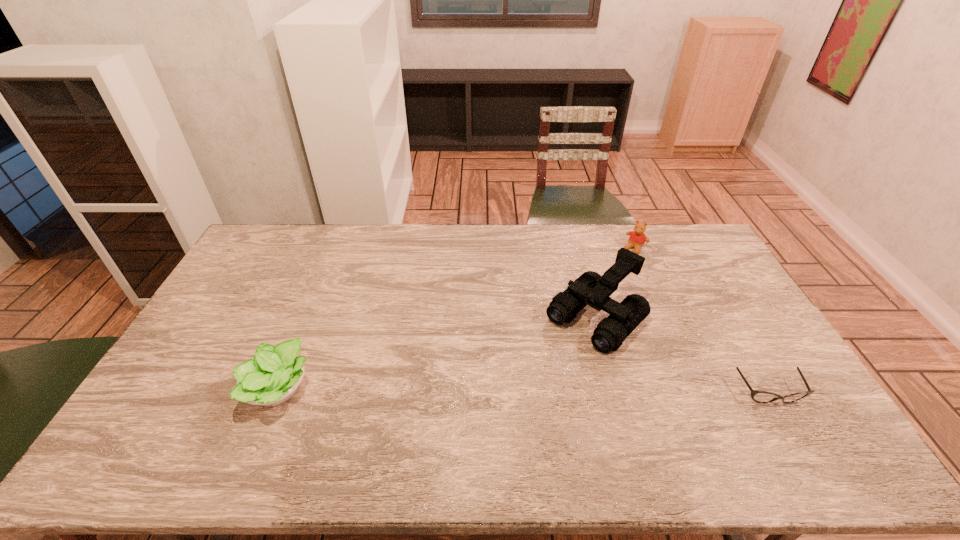
Where is `vacant space in between the tallest object and the lettuce`? The width and height of the screenshot is (960, 540). vacant space in between the tallest object and the lettuce is located at coordinates (438, 354).

Find the location of a particular element. vacant region between the lettuce and the binoculars is located at coordinates (438, 354).

The width and height of the screenshot is (960, 540). Identify the location of vacant space that is in between the lettuce and the binoculars. pyautogui.click(x=438, y=354).

Where is `free space between the leftmost object and the third object from right to left`? This screenshot has height=540, width=960. free space between the leftmost object and the third object from right to left is located at coordinates 438,354.

Locate an element on the screen. vacant space in between the third object from left to right and the lettuce is located at coordinates (457, 319).

Identify which object is located as the nearest to the leftmost object. Please provide its 2D coordinates. Your answer should be formatted as a tuple, i.e. [(x, y)], where the tuple contains the x and y coordinates of a point satisfying the conditions above.

[(592, 289)]

Select which object appears as the third closest to the spectacles. Please provide its 2D coordinates. Your answer should be formatted as a tuple, i.e. [(x, y)], where the tuple contains the x and y coordinates of a point satisfying the conditions above.

[(272, 377)]

Identify the location of vacant point that satisfies the following two spatial constraints: 1. on the back side of the second object from left to right; 2. on the left side of the farthest object. (576, 248).